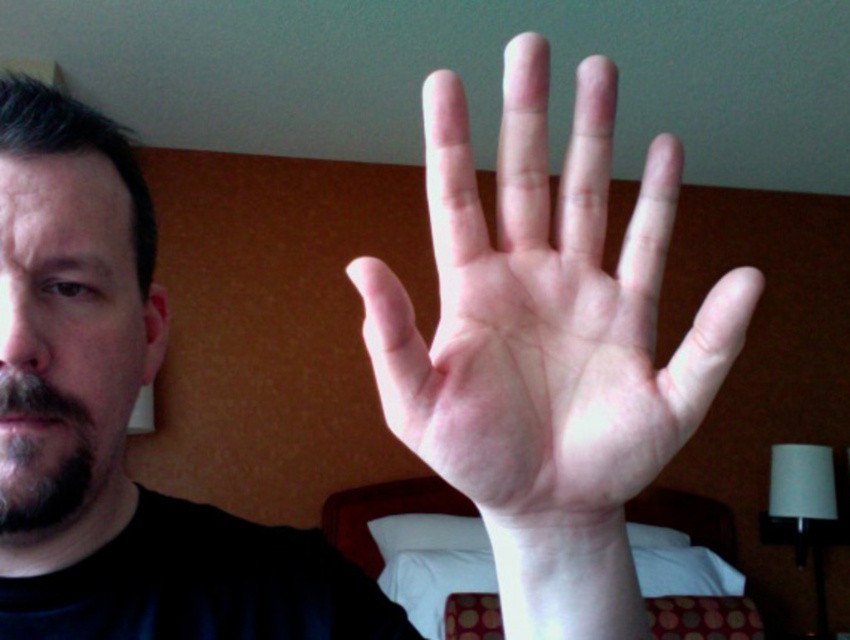
You are a photographer trying to capture a close portrait of the pale skin hand at center and the dark brown beard at left. Based on their positions, which object should you focus on first to ensure both are in frame?

The pale skin hand at center is much taller than the dark brown beard at left, so you should focus on the pale skin hand at center first to ensure both fit within the frame.

You are a photographer adjusting lighting for a portrait. You notice the pale skin hand at center and the dark brown beard at left in your frame. Which object should you adjust the lighting to highlight more effectively, considering their sizes?

The pale skin hand at center is wider than the dark brown beard at left, so you should adjust the lighting to highlight the pale skin hand at center more effectively since it has a larger surface area to work with.

From the picture: You are a photographer setting up a shot in a hotel room. You want to position the white fabric bed at center and the dark brown beard at left so that the bed is above the beard in the final image. Is this possible given their current positions?

The white fabric bed at center is currently below the dark brown beard at left. To have the bed above the beard in the image, you would need to adjust their positions or the camera angle since their current arrangement places the bed lower than the beard.